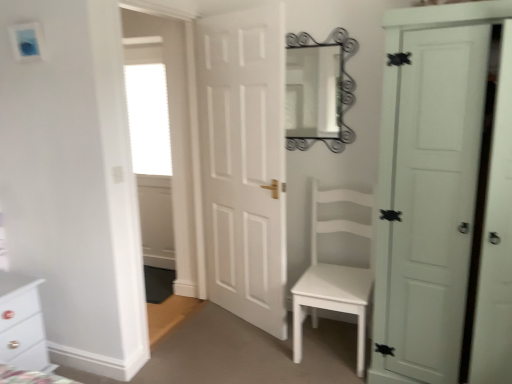
Question: Is white glossy chest of drawers at lower left turned away from metallic silver mirror at upper center?

Choices:
 (A) yes
 (B) no

Answer: (B)

Question: Can you confirm if white glossy chest of drawers at lower left is taller than metallic silver mirror at upper center?

Choices:
 (A) yes
 (B) no

Answer: (B)

Question: Is white glossy chest of drawers at lower left not near metallic silver mirror at upper center?

Choices:
 (A) yes
 (B) no

Answer: (A)

Question: From the image's perspective, is white glossy chest of drawers at lower left under metallic silver mirror at upper center?

Choices:
 (A) yes
 (B) no

Answer: (A)

Question: Is white glossy chest of drawers at lower left bigger than metallic silver mirror at upper center?

Choices:
 (A) yes
 (B) no

Answer: (A)

Question: Relative to metallic silver mirror at upper center, is white frosted glass window at upper left in front or behind?

Choices:
 (A) behind
 (B) front

Answer: (A)

Question: In the image, is white frosted glass window at upper left on the left side or the right side of metallic silver mirror at upper center?

Choices:
 (A) left
 (B) right

Answer: (A)

Question: Based on their sizes in the image, would you say white frosted glass window at upper left is bigger or smaller than metallic silver mirror at upper center?

Choices:
 (A) small
 (B) big

Answer: (B)

Question: From the image's perspective, is white frosted glass window at upper left located above or below metallic silver mirror at upper center?

Choices:
 (A) below
 (B) above

Answer: (A)

Question: Considering the positions of white matte chair at center and white glossy chest of drawers at lower left in the image, is white matte chair at center bigger or smaller than white glossy chest of drawers at lower left?

Choices:
 (A) small
 (B) big

Answer: (B)

Question: From their relative heights in the image, would you say white matte chair at center is taller or shorter than white glossy chest of drawers at lower left?

Choices:
 (A) tall
 (B) short

Answer: (A)

Question: In terms of width, does white matte chair at center look wider or thinner when compared to white glossy chest of drawers at lower left?

Choices:
 (A) thin
 (B) wide

Answer: (B)

Question: Is white matte chair at center inside the boundaries of white glossy chest of drawers at lower left, or outside?

Choices:
 (A) outside
 (B) inside

Answer: (A)

Question: Is white matte door at right, the 2th door from the left, in front of or behind white matte door at center, which appears as the second door when viewed from the right, in the image?

Choices:
 (A) behind
 (B) front

Answer: (B)

Question: Looking at the image, does white matte door at right, the 1th door positioned from the right, seem bigger or smaller compared to white matte door at center, which appears as the second door when viewed from the right?

Choices:
 (A) big
 (B) small

Answer: (A)